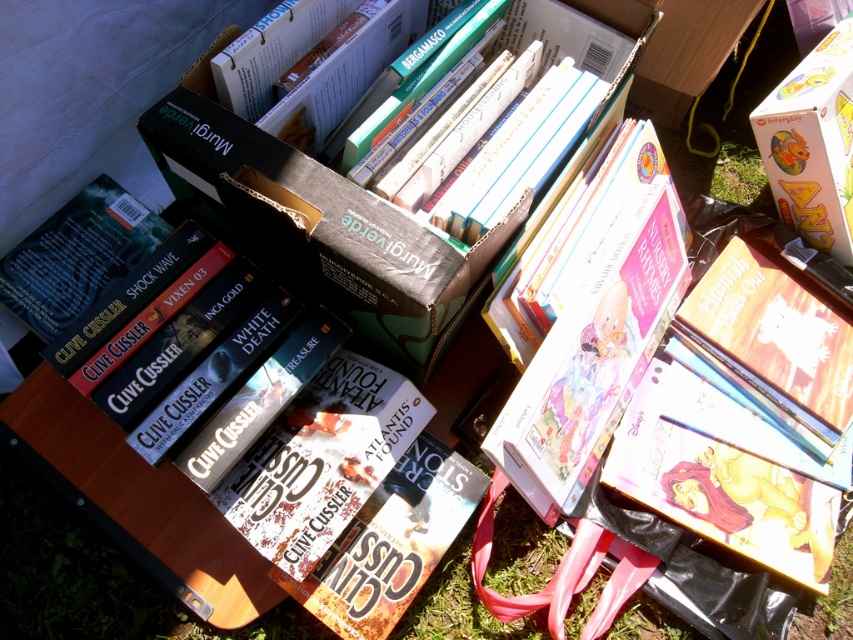
In the scene shown: You are standing in front of a display of books at a flea market. You notice two points marked in the scene. Which point is closer to you, point (830, 177) or point (759, 182)?

Point (830, 177) is closer to the viewer than point (759, 182).

You are organizing a book sale and need to place a new book between the hardcover book at center and the yellow cardboard box at upper right. What is the minimum distance you need to maintain between them to ensure the new book fits?

The minimum distance required is 77.20 centimeters, as that is the current distance between the hardcover book at center and the yellow cardboard box at upper right.

You are a customer at a book sale and see the yellow cardboard box at upper right and the green grass at lower right. Which object is closer to you?

The yellow cardboard box at upper right is closer to you because it is in front of the green grass at lower right.